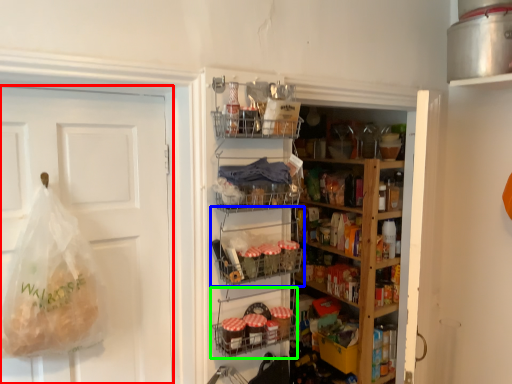
Question: Estimate the real-world distances between objects in this image. Which object is closer to door (highlighted by a red box), shelf (highlighted by a blue box) or shelf (highlighted by a green box)?

Choices:
 (A) shelf
 (B) shelf

Answer: (A)